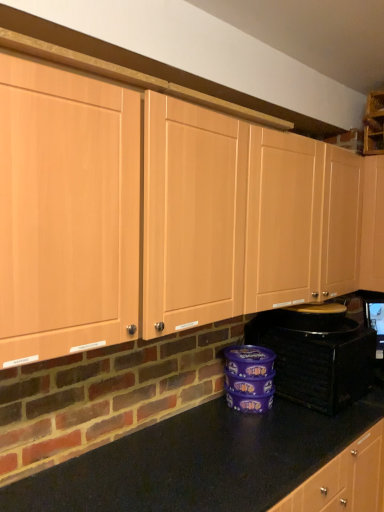
This screenshot has width=384, height=512. What do you see at coordinates (249, 218) in the screenshot?
I see `matte wood cabinets at center` at bounding box center [249, 218].

At what (x,y) coordinates should I click in order to perform the action: click on matte wood cabinets at center. Please return your answer as a coordinate pair (x, y). The width and height of the screenshot is (384, 512). Looking at the image, I should click on (249, 218).

Measure the distance between matte wood cabinets at center and camera.

matte wood cabinets at center and camera are 37.42 inches apart.

Image resolution: width=384 pixels, height=512 pixels. Identify the location of black plastic toaster at lower right. (316, 357).

What do you see at coordinates (316, 357) in the screenshot?
I see `black plastic toaster at lower right` at bounding box center [316, 357].

In order to face black plastic toaster at lower right, should I rotate leftwards or rightwards?

Rotate right and turn 15.830 degrees.

Find the location of a particular element. Image resolution: width=384 pixels, height=512 pixels. matte wood cabinets at center is located at coordinates (249, 218).

Does black plastic toaster at lower right appear on the right side of matte wood cabinets at center?

Yes, black plastic toaster at lower right is to the right of matte wood cabinets at center.

Considering the positions of objects black plastic toaster at lower right and matte wood cabinets at center in the image provided, who is behind, black plastic toaster at lower right or matte wood cabinets at center?

Positioned behind is black plastic toaster at lower right.

Is point (289, 376) more distant than point (12, 186)?

Yes, it is behind point (12, 186).

From the image's perspective, is black plastic toaster at lower right located above matte wood cabinets at center?

No, from the image's perspective, black plastic toaster at lower right is not above matte wood cabinets at center.

From a real-world perspective, between black plastic toaster at lower right and matte wood cabinets at center, who is vertically lower?

black plastic toaster at lower right, from a real-world perspective.

Considering the sizes of objects black plastic toaster at lower right and matte wood cabinets at center in the image provided, who is thinner, black plastic toaster at lower right or matte wood cabinets at center?

With smaller width is matte wood cabinets at center.

Can you confirm if black plastic toaster at lower right is shorter than matte wood cabinets at center?

Indeed, black plastic toaster at lower right has a lesser height compared to matte wood cabinets at center.

Based on the photo, does black plastic toaster at lower right have a larger size compared to matte wood cabinets at center?

No.

Is black plastic toaster at lower right inside or outside of matte wood cabinets at center?

black plastic toaster at lower right is not inside matte wood cabinets at center, it's outside.

Would you consider black plastic toaster at lower right to be distant from matte wood cabinets at center?

They are positioned close to each other.

Could you tell me if black plastic toaster at lower right is turned towards matte wood cabinets at center?

No.

At what (x,y) coordinates should I click in order to perform the action: click on cabinetry located on the left of black plastic toaster at lower right. Please return your answer as a coordinate pair (x, y). The height and width of the screenshot is (512, 384). Looking at the image, I should click on (249, 218).

Is matte wood cabinets at center at the right side of black plastic toaster at lower right?

In fact, matte wood cabinets at center is to the left of black plastic toaster at lower right.

Which object is more forward, matte wood cabinets at center or black plastic toaster at lower right?

matte wood cabinets at center is more forward.

Between point (234, 172) and point (341, 328), which one is positioned in front?

The point (234, 172) is closer to the camera.

From the image's perspective, is matte wood cabinets at center above black plastic toaster at lower right?

Correct, matte wood cabinets at center appears higher than black plastic toaster at lower right in the image.

From a real-world perspective, relative to black plastic toaster at lower right, is matte wood cabinets at center vertically above or below?

matte wood cabinets at center is above black plastic toaster at lower right.

Is matte wood cabinets at center thinner than black plastic toaster at lower right?

Correct, the width of matte wood cabinets at center is less than that of black plastic toaster at lower right.

Considering the sizes of matte wood cabinets at center and black plastic toaster at lower right in the image, is matte wood cabinets at center taller or shorter than black plastic toaster at lower right?

matte wood cabinets at center is taller than black plastic toaster at lower right.

Based on their sizes in the image, would you say matte wood cabinets at center is bigger or smaller than black plastic toaster at lower right?

matte wood cabinets at center is bigger than black plastic toaster at lower right.

Is black plastic toaster at lower right completely or partially inside matte wood cabinets at center?

No, matte wood cabinets at center does not contain black plastic toaster at lower right.

From the picture: Is matte wood cabinets at center not close to black plastic toaster at lower right?

No, matte wood cabinets at center is in close proximity to black plastic toaster at lower right.

Is matte wood cabinets at center turned away from black plastic toaster at lower right?

No, matte wood cabinets at center is not facing away from black plastic toaster at lower right.

What's the angular difference between matte wood cabinets at center and black plastic toaster at lower right's facing directions?

The facing directions of matte wood cabinets at center and black plastic toaster at lower right are 0.364 degrees apart.

At what (x,y) coordinates should I click in order to perform the action: click on home appliance on the right side of matte wood cabinets at center. Please return your answer as a coordinate pair (x, y). This screenshot has height=512, width=384. Looking at the image, I should click on (316, 357).

Where is `home appliance that is below the matte wood cabinets at center (from the image's perspective)`? The height and width of the screenshot is (512, 384). home appliance that is below the matte wood cabinets at center (from the image's perspective) is located at coordinates (316, 357).

In the image, there is a matte wood cabinets at center. At what (x,y) coordinates should I click in order to perform the action: click on home appliance below it (from a real-world perspective). Please return your answer as a coordinate pair (x, y). The height and width of the screenshot is (512, 384). Looking at the image, I should click on (316, 357).